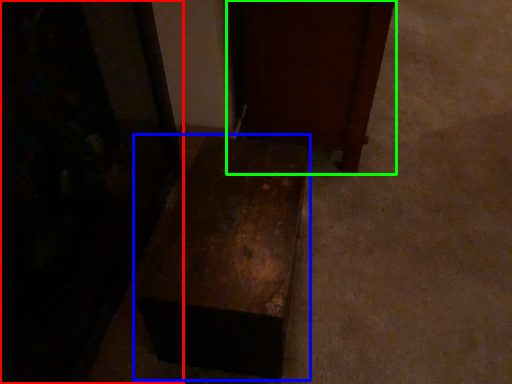
Question: Which object is positioned closest to furniture (highlighted by a red box)? Select from furniture (highlighted by a blue box) and furniture (highlighted by a green box).

Choices:
 (A) furniture
 (B) furniture

Answer: (A)